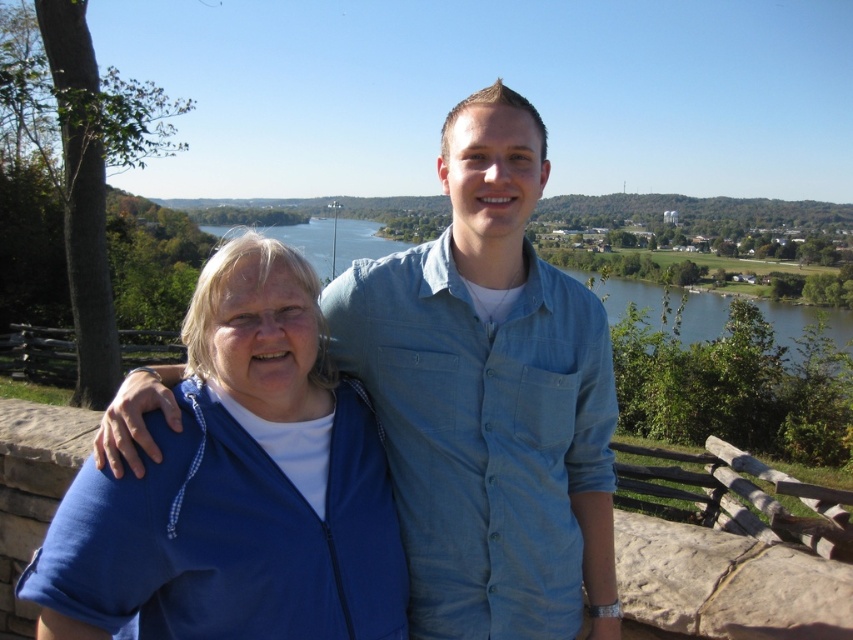
You are trying to decide which clothing item to take with you for a hike. You have the blue denim shirt at center and the blue fleece jacket at left. Which one is narrower and thus easier to pack?

The blue denim shirt at center is narrower than the blue fleece jacket at left, so it would be easier to pack.

You are a photographer trying to capture a candid shot of both the blue denim shirt at center and the blue fleece jacket at left. Which one should you focus on first to ensure they are both in focus?

You should focus on the blue denim shirt at center first because it is closer to you than the blue fleece jacket at left, ensuring both will be in focus when using depth of field techniques.

You are taking a photo of the two people in the scene. You want to focus on the person closer to the camera. Which point should you focus on, point (357, 368) or point (99, 541)?

Point (357, 368) is further to the camera than point (99, 541), so you should focus on point (357, 368) to capture the person closer to the camera.